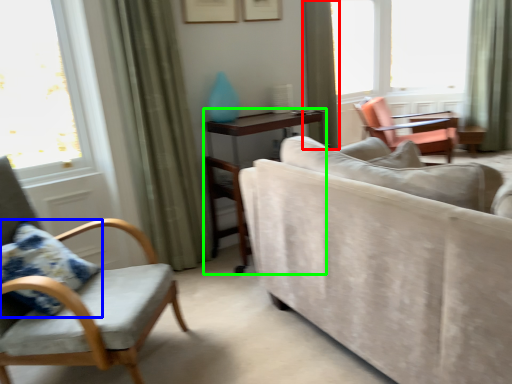
Question: Which object is the closest to the curtain (highlighted by a red box)? Choose among these: pillow (highlighted by a blue box) or table (highlighted by a green box).

Choices:
 (A) pillow
 (B) table

Answer: (B)